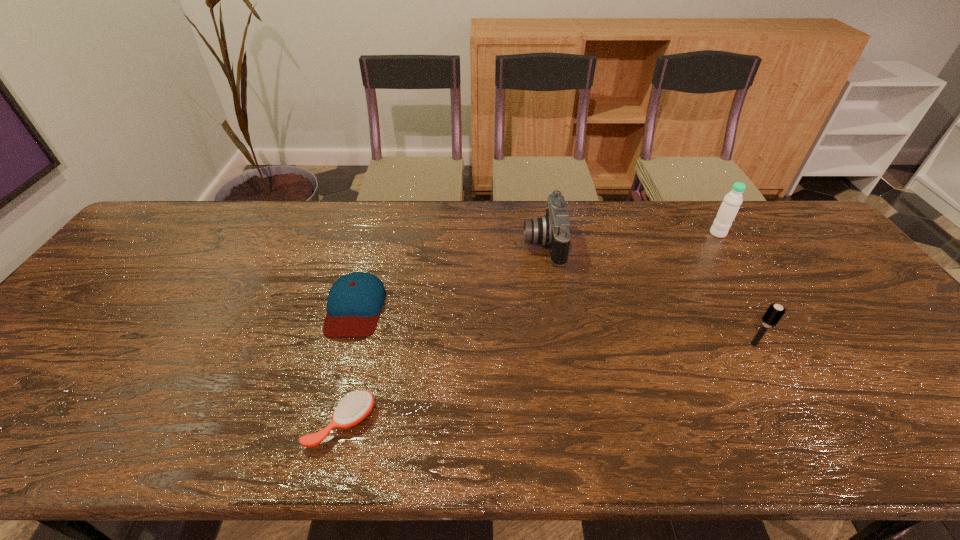
Image resolution: width=960 pixels, height=540 pixels. What are the coordinates of `free space that satisfies the following two spatial constraints: 1. on the front-facing side of the third object from left to right; 2. with the bill of the baseball cap facing forward` in the screenshot? It's located at (553, 307).

This screenshot has height=540, width=960. What are the coordinates of `blank space that satisfies the following two spatial constraints: 1. with the bill of the farther hairbrush facing forward; 2. on the right side of the second shortest object` in the screenshot? It's located at (346, 345).

Locate an element on the screen. blank space that satisfies the following two spatial constraints: 1. with the bill of the left hairbrush facing forward; 2. on the right side of the fourth tallest object is located at coordinates (324, 423).